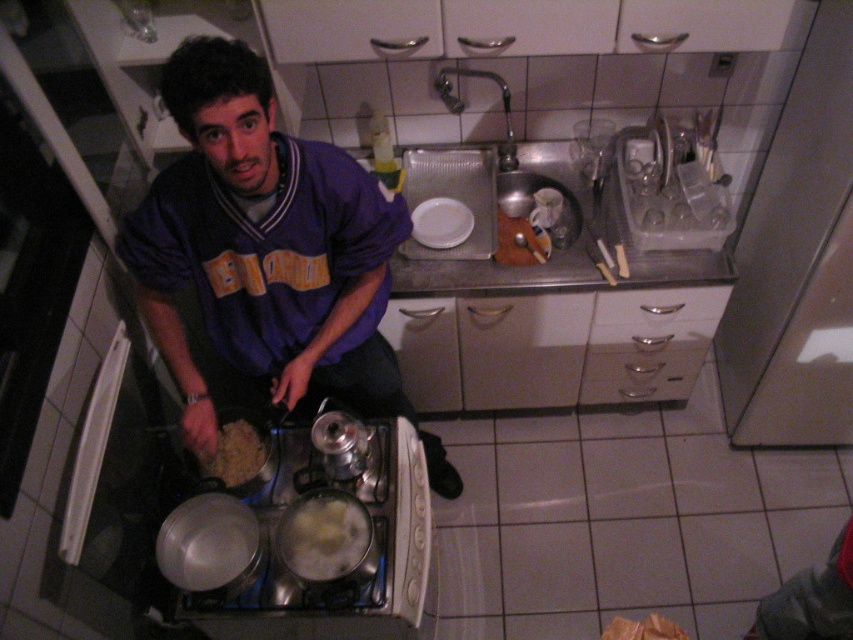
You are a chef preparing a dish and need to place two ingredients on the counter. You have a white creamy food at lower center and a brown matte rice at lower center. Which one is on the right side?

The white creamy food at lower center is positioned on the right side of brown matte rice at lower center.

You are a chef preparing a dish and need to place both the white creamy food at lower center and the brown matte rice at lower center on a small plate that can only fit one of them. Based on their sizes, which one should you choose?

The white creamy food at lower center has a larger width than the brown matte rice at lower center, so you should choose the white creamy food at lower center to place on the plate since it requires more space.

You are a chef preparing a dish and need to place both the purple jersey at center and the white creamy food at lower center on a narrow shelf. Which item should you place first to ensure they both fit?

You should place the white creamy food at lower center first because it is narrower than the purple jersey at center, which is wider. This way, there will be enough space left for the wider purple jersey at center.